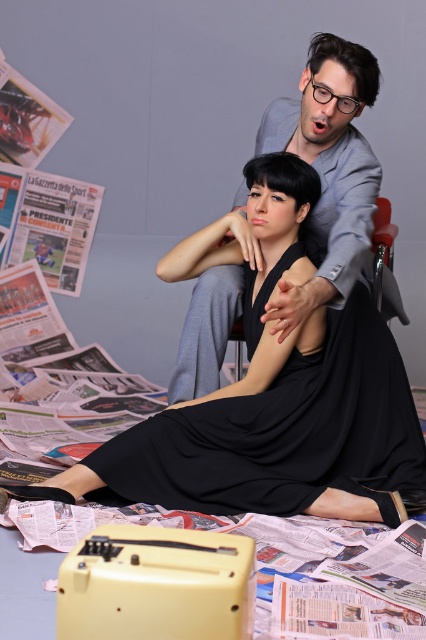
Question: Is black satin dress at center bigger than gray suit at center?

Choices:
 (A) yes
 (B) no

Answer: (B)

Question: Is black satin dress at center bigger than gray suit at center?

Choices:
 (A) yes
 (B) no

Answer: (B)

Question: Among these objects, which one is farthest from the camera?

Choices:
 (A) black satin dress at center
 (B) gray suit at center

Answer: (A)

Question: Which object appears closest to the camera in this image?

Choices:
 (A) gray suit at center
 (B) black satin dress at center

Answer: (A)

Question: Which point is farther to the camera?

Choices:
 (A) (103, 456)
 (B) (221, 356)

Answer: (B)

Question: Considering the relative positions of black satin dress at center and gray suit at center in the image provided, where is black satin dress at center located with respect to gray suit at center?

Choices:
 (A) above
 (B) below

Answer: (B)